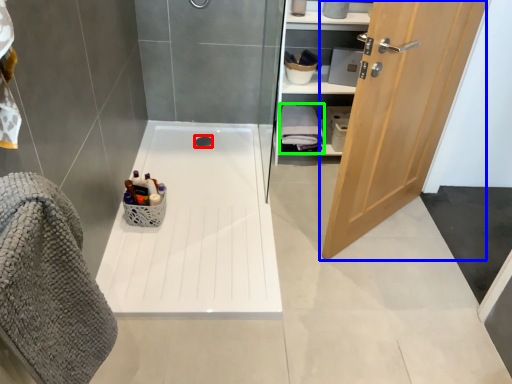
Question: Based on their relative distances, which object is nearer to drain (highlighted by a red box)? Choose from door (highlighted by a blue box) and bath towel (highlighted by a green box).

Choices:
 (A) door
 (B) bath towel

Answer: (B)